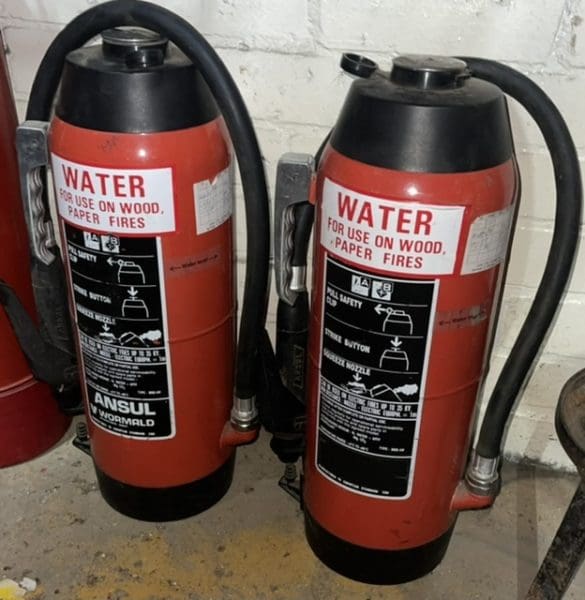
The image size is (585, 600). Find the location of `floor`. floor is located at coordinates pyautogui.click(x=223, y=543).